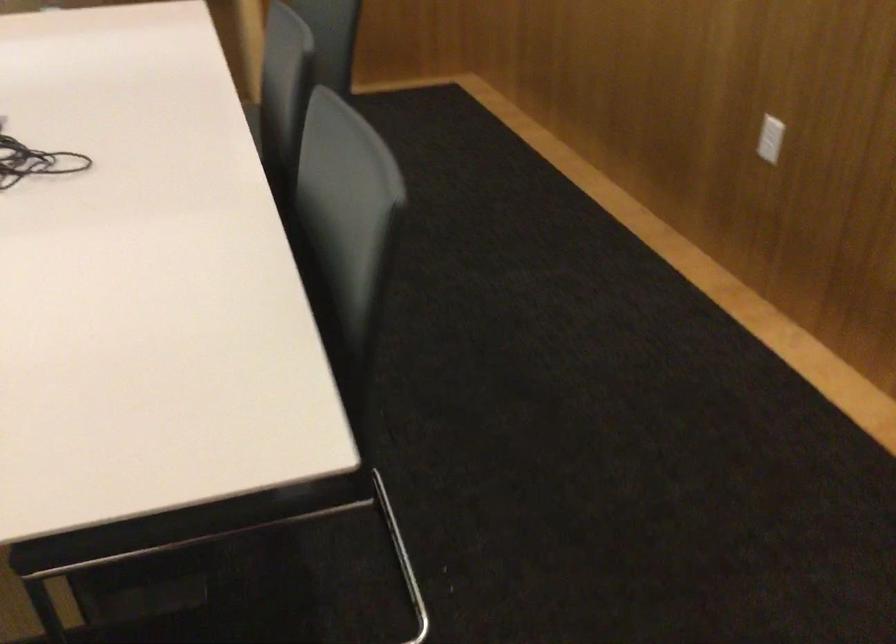
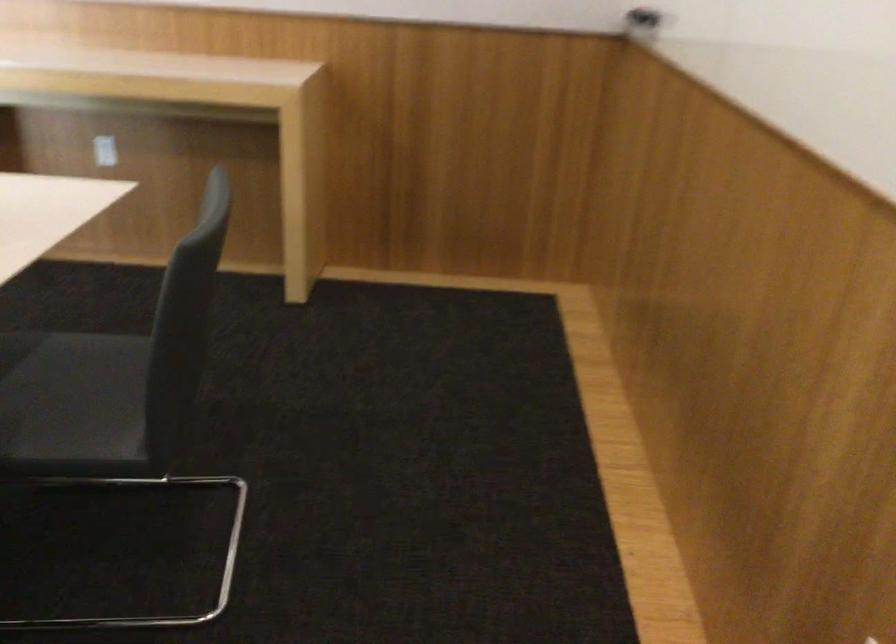
Which direction would the cameraman need to move to produce the second image?

The cameraman walked toward right, forward.